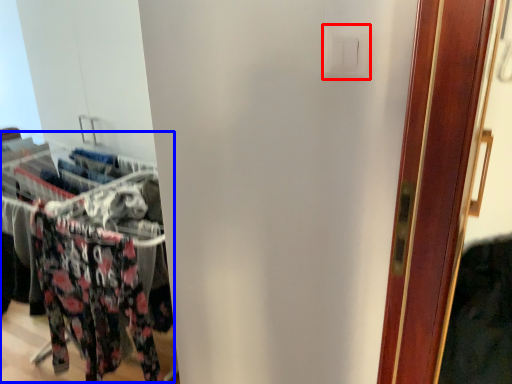
Question: Among these objects, which one is nearest to the camera, light switch (highlighted by a red box) or closet (highlighted by a blue box)?

Choices:
 (A) light switch
 (B) closet

Answer: (A)